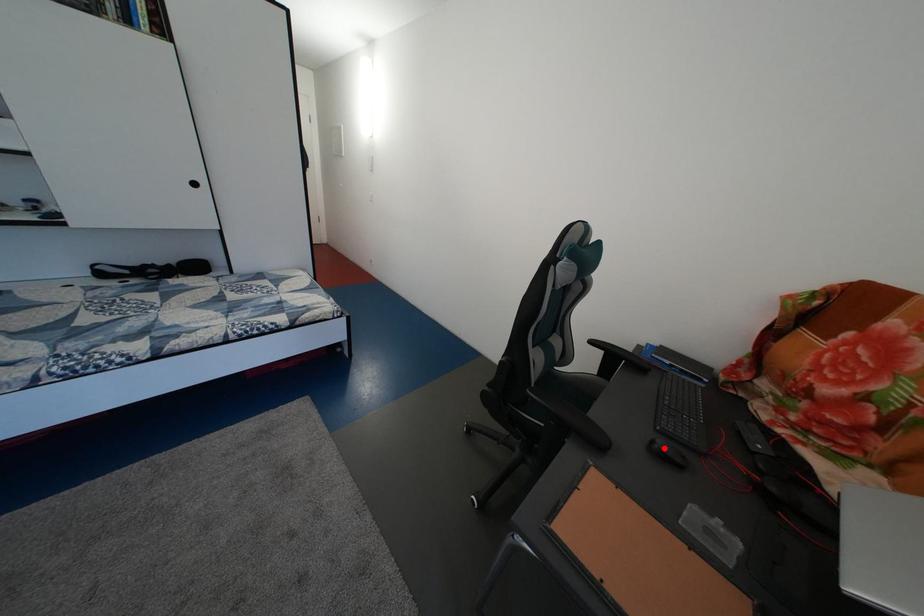
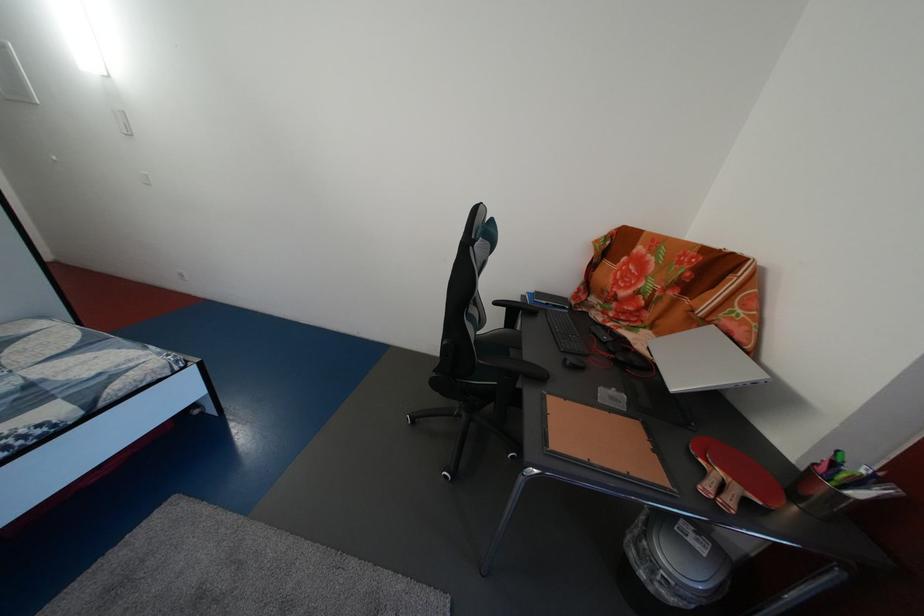
Where in the second image is the point corresponding to the highlighted location from the first image?

(576, 367)